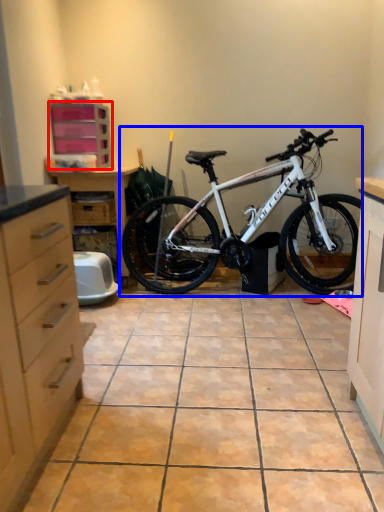
Question: Among these objects, which one is farthest to the camera, cabinetry (highlighted by a red box) or bicycle (highlighted by a blue box)?

Choices:
 (A) cabinetry
 (B) bicycle

Answer: (A)